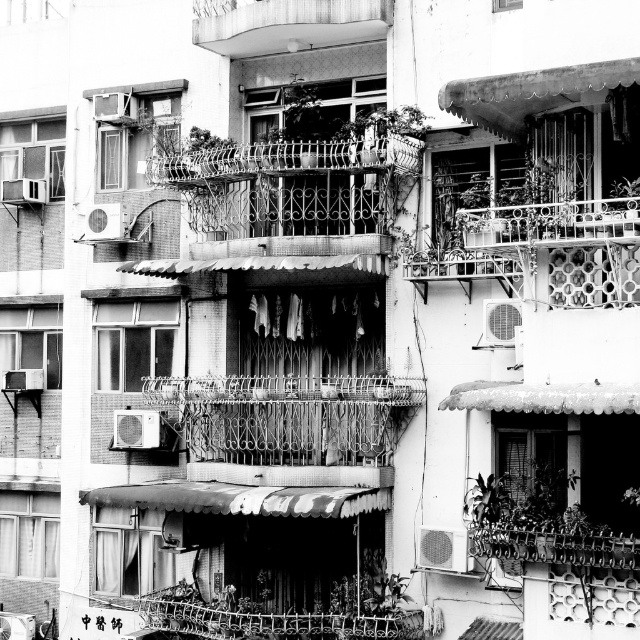
What do you see at coordinates (285, 160) in the screenshot? Image resolution: width=640 pixels, height=640 pixels. I see `wrought iron balcony at center` at bounding box center [285, 160].

Which is in front, point (385, 161) or point (620, 236)?

Point (620, 236) is in front.

The height and width of the screenshot is (640, 640). Identify the location of wrought iron balcony at center. (285, 160).

Can you confirm if rusty metal balcony at upper right is taller than metallic air conditioner at upper left?

Yes.

Between rusty metal balcony at upper right and metallic air conditioner at upper left, which one has more height?

rusty metal balcony at upper right

Between point (515, 230) and point (33, 182), which one is positioned in front?

Positioned in front is point (515, 230).

The height and width of the screenshot is (640, 640). Find the location of `rusty metal balcony at upper right`. rusty metal balcony at upper right is located at coordinates (550, 224).

Which is below, wrought iron balcony at center or metallic air conditioner at upper left?

wrought iron balcony at center is lower down.

Does wrought iron balcony at center have a smaller size compared to metallic air conditioner at upper left?

Correct, wrought iron balcony at center occupies less space than metallic air conditioner at upper left.

In order to click on wrought iron balcony at center in this screenshot , I will do (285, 160).